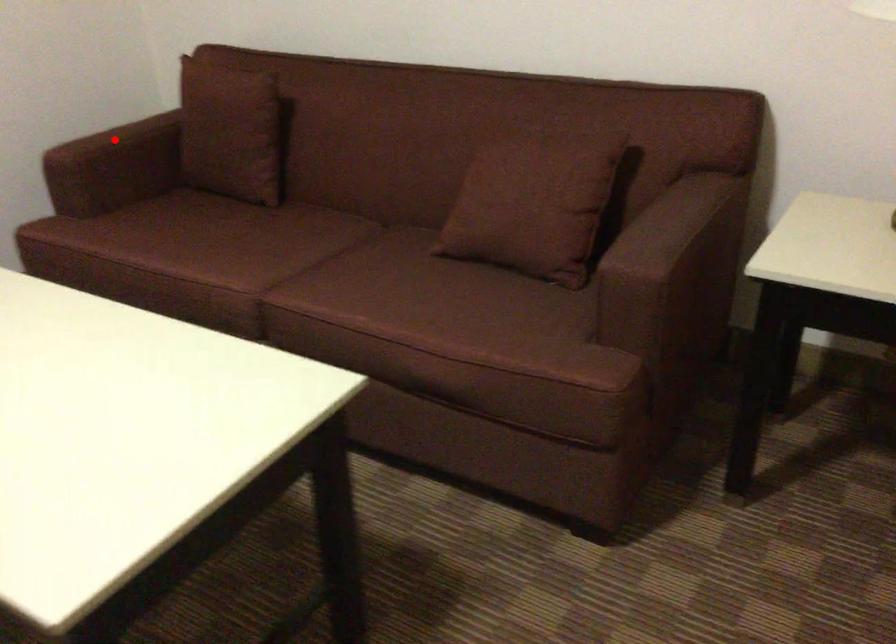
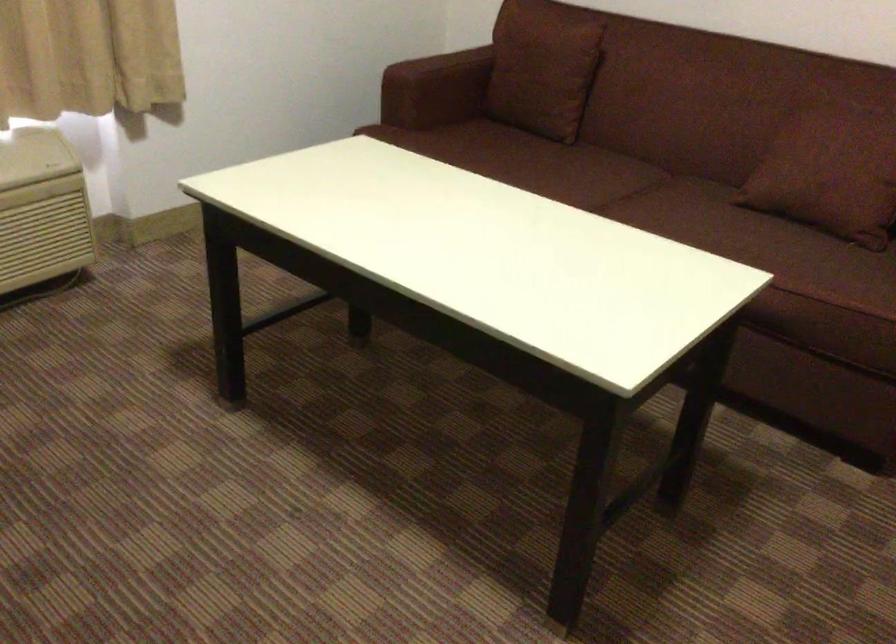
Locate, in the second image, the point that corresponds to the highlighted location in the first image.

(441, 66)